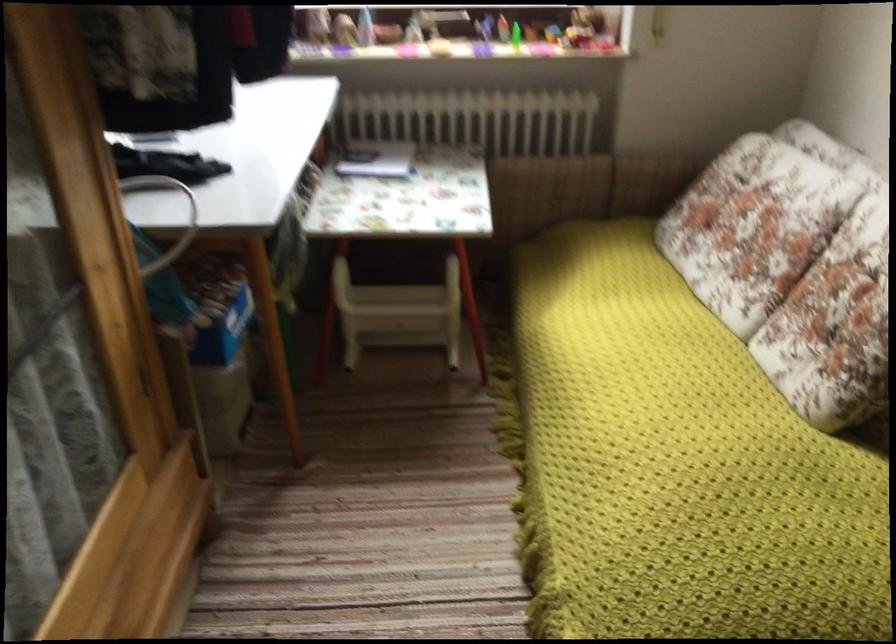
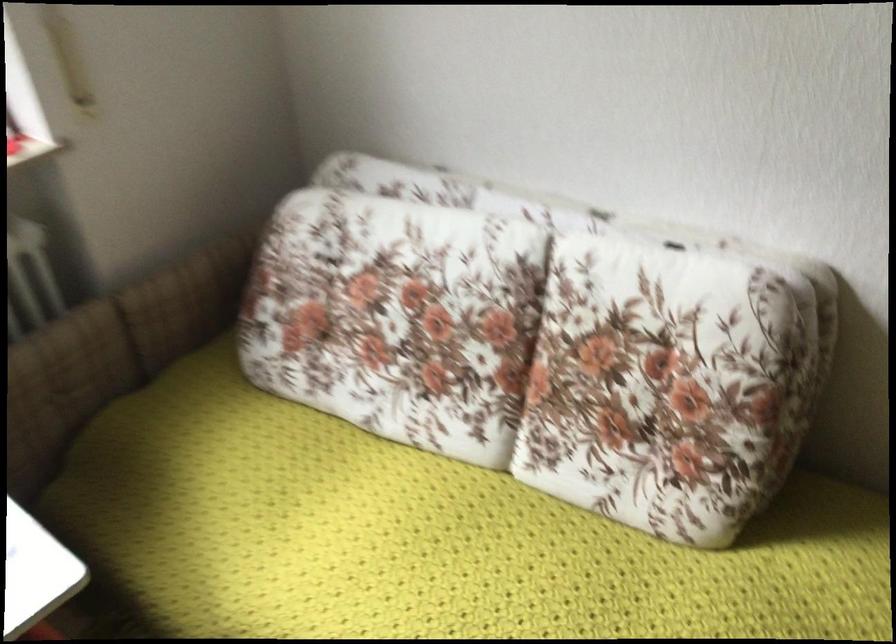
In the second image, find the point that corresponds to point (554, 185) in the first image.

(63, 384)